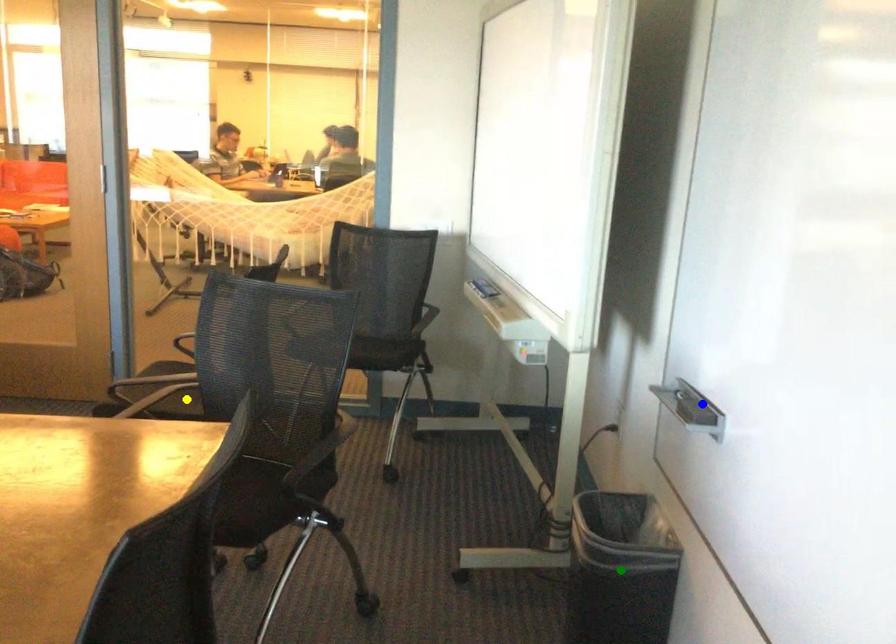
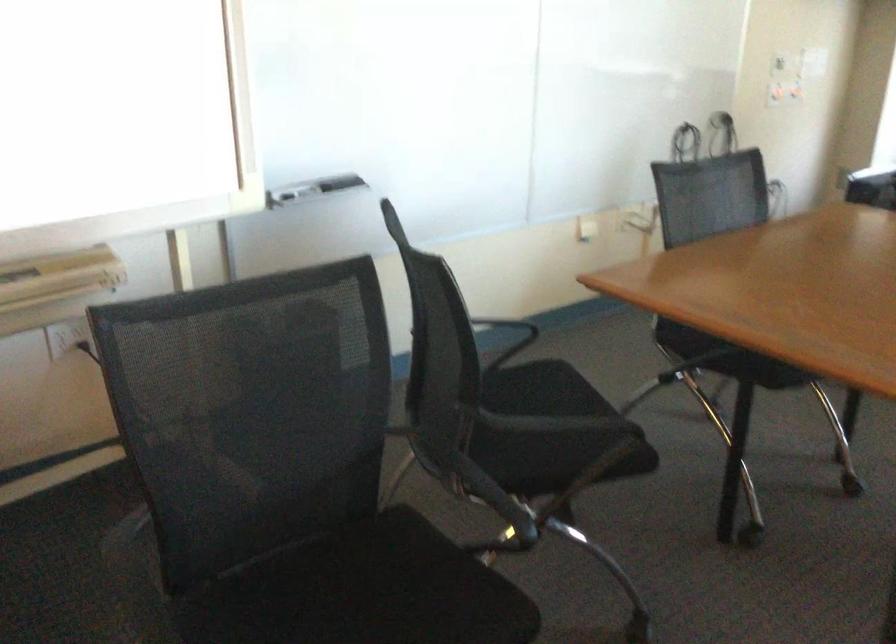
I am providing you with two images of the same scene from different viewpoints. Three points are marked in image1. Which point corresponds to a part or object that is occluded in image2?In image1, three points are marked. Which of them correspond to a part or object that is occluded in image2?Among the three points shown in image1, which one corresponds to a part or object that is no longer visible due to occlusion in image2?

Invisible in image2: green point.